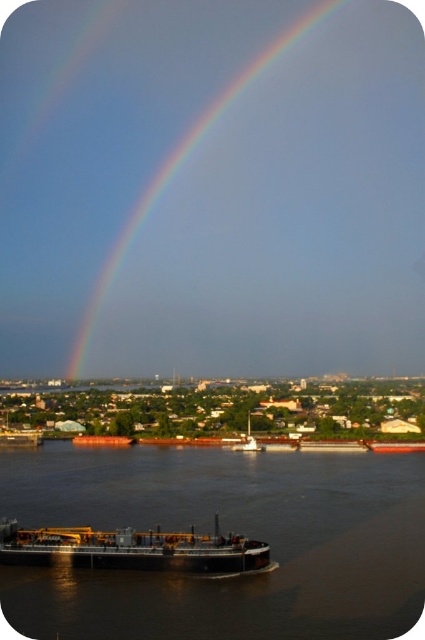
Question: Is black matte water at center smaller than black matte barge at lower center?

Choices:
 (A) yes
 (B) no

Answer: (B)

Question: Observing the image, what is the correct spatial positioning of black matte barge at lower center in reference to rainbow at upper center?

Choices:
 (A) left
 (B) right

Answer: (A)

Question: Does black matte barge at lower center have a greater width compared to rainbow at upper center?

Choices:
 (A) yes
 (B) no

Answer: (B)

Question: Which point is farther to the camera?

Choices:
 (A) (104, 554)
 (B) (144, 205)

Answer: (B)

Question: Which of the following is the farthest from the observer?

Choices:
 (A) rainbow at upper center
 (B) black matte barge at lower center
 (C) black matte water at center

Answer: (A)

Question: Which object is closer to the camera taking this photo?

Choices:
 (A) rainbow at upper center
 (B) black matte water at center

Answer: (B)